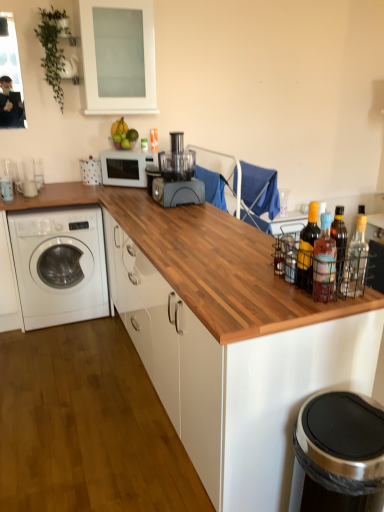
Question: Choose the correct answer: Is matte yellow glass bottle at right, which is the 3th bottle from right to left, inside transparent glass cabinet at upper center or outside it?

Choices:
 (A) inside
 (B) outside

Answer: (B)

Question: From a real-world perspective, is matte yellow glass bottle at right, which is the second bottle from back to front, positioned above or below transparent glass cabinet at upper center?

Choices:
 (A) above
 (B) below

Answer: (B)

Question: Which of these objects is positioned farthest from the matte gray blender at center?

Choices:
 (A) wooden at center
 (B) clear glass bottle at right, the third bottle in the left-to-right sequence
 (C) matte yellow glass bottle at right, which is the second bottle from back to front
 (D) transparent glass cabinet at upper center
 (E) white glossy washing machine at left

Answer: (B)

Question: Which object is positioned closest to the matte yellow glass bottle at right, the 1th bottle positioned from the left?

Choices:
 (A) transparent glass cabinet at upper center
 (B) translucent glass bottles at right, which ranks as the 2th bottle in left-to-right order
 (C) matte gray blender at center
 (D) white matte microwave at center
 (E) wooden at center

Answer: (B)